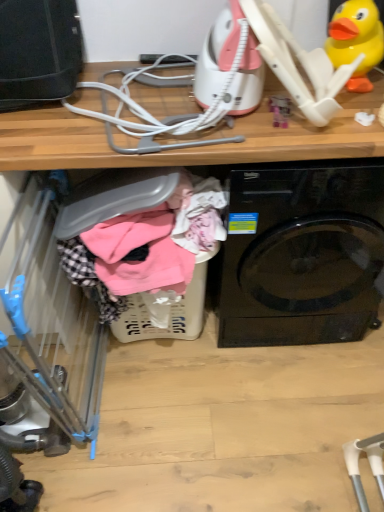
The height and width of the screenshot is (512, 384). Describe the element at coordinates (356, 40) in the screenshot. I see `yellow rubber duck at upper right` at that location.

Image resolution: width=384 pixels, height=512 pixels. Describe the element at coordinates (171, 311) in the screenshot. I see `plastic laundry basket at lower center` at that location.

At what (x,y) coordinates should I click in order to perform the action: click on yellow rubber duck at upper right. Please return your answer as a coordinate pair (x, y). Looking at the image, I should click on (356, 40).

Does black glossy washing machine at center lie behind plastic laundry basket at lower center?

No, black glossy washing machine at center is closer to the camera.

From a real-world perspective, which is physically above, black glossy washing machine at center or plastic laundry basket at lower center?

In real-world perspective, black glossy washing machine at center is above.

Looking at this image, from the image's perspective, is black glossy washing machine at center under plastic laundry basket at lower center?

No, from the image's perspective, black glossy washing machine at center is not below plastic laundry basket at lower center.

In the image, is blue plastic baby carriage at left on the left side or the right side of black glossy washing machine at center?

From the image, it's evident that blue plastic baby carriage at left is to the left of black glossy washing machine at center.

Who is taller, blue plastic baby carriage at left or black glossy washing machine at center?

With more height is blue plastic baby carriage at left.

Measure the distance between blue plastic baby carriage at left and black glossy washing machine at center.

blue plastic baby carriage at left is 28.19 inches away from black glossy washing machine at center.

Are blue plastic baby carriage at left and black glossy washing machine at center located far from each other?

No, there isn't a large distance between blue plastic baby carriage at left and black glossy washing machine at center.

Considering the relative sizes of plastic laundry basket at lower center and yellow rubber duck at upper right in the image provided, is plastic laundry basket at lower center taller than yellow rubber duck at upper right?

Yes, plastic laundry basket at lower center is taller than yellow rubber duck at upper right.

Who is smaller, plastic laundry basket at lower center or yellow rubber duck at upper right?

yellow rubber duck at upper right.

Is plastic laundry basket at lower center looking in the opposite direction of yellow rubber duck at upper right?

plastic laundry basket at lower center does not have its back to yellow rubber duck at upper right.

From a real-world perspective, which is physically below, plastic laundry basket at lower center or yellow rubber duck at upper right?

From a 3D spatial view, plastic laundry basket at lower center is below.

How far apart are yellow rubber duck at upper right and plastic laundry basket at lower center?

They are 84.43 centimeters apart.

Is yellow rubber duck at upper right smaller than plastic laundry basket at lower center?

Yes, yellow rubber duck at upper right is smaller than plastic laundry basket at lower center.

What's the angular difference between yellow rubber duck at upper right and plastic laundry basket at lower center's facing directions?

43.2 degrees separate the facing orientations of yellow rubber duck at upper right and plastic laundry basket at lower center.

Is yellow rubber duck at upper right at the right side of plastic laundry basket at lower center?

Yes.

From the image's perspective, does blue plastic baby carriage at left appear higher than plastic laundry basket at lower center?

No, from the image's perspective, blue plastic baby carriage at left is not on top of plastic laundry basket at lower center.

In order to click on basket located underneath the blue plastic baby carriage at left (from a real-world perspective) in this screenshot , I will do click(171, 311).

Is blue plastic baby carriage at left positioned before plastic laundry basket at lower center?

Yes, blue plastic baby carriage at left is closer to the viewer.

Which of these two, black glossy washing machine at center or blue plastic baby carriage at left, stands shorter?

black glossy washing machine at center.

Consider the image. Considering the sizes of objects black glossy washing machine at center and blue plastic baby carriage at left in the image provided, who is wider, black glossy washing machine at center or blue plastic baby carriage at left?

blue plastic baby carriage at left.

Which object is positioned more to the right, black glossy washing machine at center or blue plastic baby carriage at left?

black glossy washing machine at center.

From the image's perspective, which object appears higher, black glossy washing machine at center or blue plastic baby carriage at left?

black glossy washing machine at center, from the image's perspective.

From the picture: From the image's perspective, is yellow rubber duck at upper right located above black glossy washing machine at center?

Yes, from the image's perspective, yellow rubber duck at upper right is on top of black glossy washing machine at center.

Would you say black glossy washing machine at center is part of yellow rubber duck at upper right's contents?

No, black glossy washing machine at center is not a part of yellow rubber duck at upper right.

Is point (372, 10) closer or farther from the camera than point (355, 190)?

Point (372, 10) is closer to the camera than point (355, 190).

Is yellow rubber duck at upper right oriented away from black glossy washing machine at center?

yellow rubber duck at upper right does not have its back to black glossy washing machine at center.

Locate an element on the screen. washing machine in front of the plastic laundry basket at lower center is located at coordinates (302, 254).

The height and width of the screenshot is (512, 384). What are the coordinates of `baby carriage that is under the black glossy washing machine at center (from a real-world perspective)` in the screenshot? It's located at (54, 332).

Based on their spatial positions, is black glossy washing machine at center or blue plastic baby carriage at left closer to plastic laundry basket at lower center?

blue plastic baby carriage at left is positioned closer to the anchor plastic laundry basket at lower center.

From the image, which object appears to be farther from black glossy washing machine at center, plastic laundry basket at lower center or blue plastic baby carriage at left?

blue plastic baby carriage at left is positioned further to the anchor black glossy washing machine at center.

Which object lies further to the anchor point yellow rubber duck at upper right, black glossy washing machine at center or plastic laundry basket at lower center?

plastic laundry basket at lower center.

Looking at the image, which one is located closer to black glossy washing machine at center, plastic laundry basket at lower center or yellow rubber duck at upper right?

The object closer to black glossy washing machine at center is plastic laundry basket at lower center.

Estimate the real-world distances between objects in this image. Which object is closer to yellow rubber duck at upper right, plastic laundry basket at lower center or black glossy washing machine at center?

black glossy washing machine at center.

Based on their spatial positions, is yellow rubber duck at upper right or plastic laundry basket at lower center closer to black glossy washing machine at center?

plastic laundry basket at lower center.

When comparing their distances from black glossy washing machine at center, does blue plastic baby carriage at left or yellow rubber duck at upper right seem further?

blue plastic baby carriage at left is further to black glossy washing machine at center.

From the image, which object appears to be nearer to plastic laundry basket at lower center, yellow rubber duck at upper right or blue plastic baby carriage at left?

blue plastic baby carriage at left.

I want to click on washing machine between blue plastic baby carriage at left and yellow rubber duck at upper right, so click(x=302, y=254).

Find the location of `basket located between blue plastic baby carriage at left and yellow rubber duck at upper right in the left-right direction`. basket located between blue plastic baby carriage at left and yellow rubber duck at upper right in the left-right direction is located at coordinates (171, 311).

I want to click on washing machine between yellow rubber duck at upper right and plastic laundry basket at lower center from top to bottom, so click(302, 254).

Image resolution: width=384 pixels, height=512 pixels. Find the location of `basket between blue plastic baby carriage at left and black glossy washing machine at center in the horizontal direction`. basket between blue plastic baby carriage at left and black glossy washing machine at center in the horizontal direction is located at coordinates (171, 311).